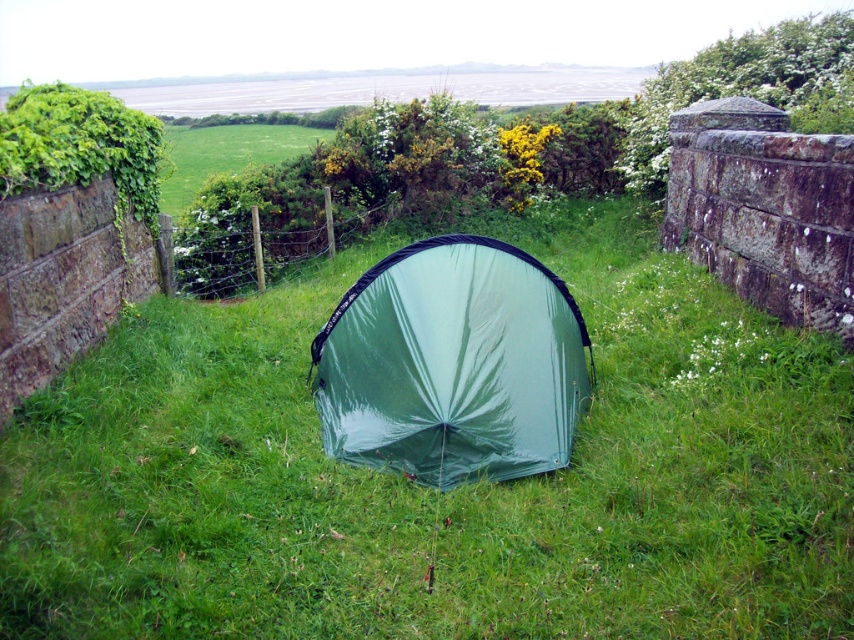
You are a hiker who wants to set up a tent. You have a tent that is 2 meters wide. You see the green fabric tent at center and the green grassy field at center. Can you place your tent in the space between them?

The green fabric tent at center is 23.38 meters from green grassy field at center. Since your tent is only 2 meters wide, there is enough space between them to place your tent.

You are standing at the point marked by coordinates point [452,364] in the image. What object are you directly at?

You are directly at the green shiny tent at center marked by point [452,364].

You are standing at point (507, 355) and want to walk to the green tent at center. Can you reach it without crossing the stone wall on the left?

The distance between you and the green tent at center is 4.52 meters. Since there is a clear path through the grassy area and the stone wall on the left is only partially blocking, you can reach the tent without crossing the wall.